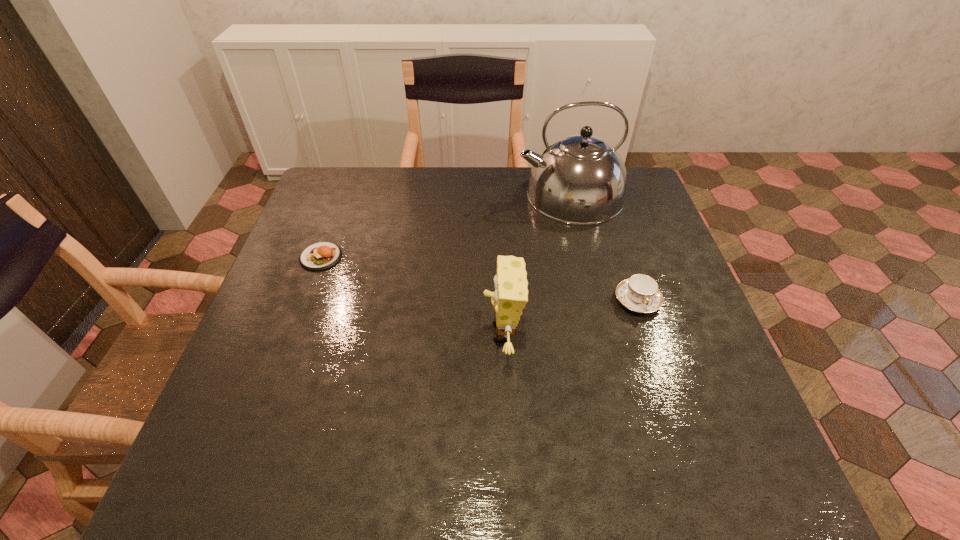
The image size is (960, 540). In the image, there is a desktop. What are the coordinates of `free space at the far edge` in the screenshot? It's located at (475, 198).

In the image, there is a desktop. At what (x,y) coordinates should I click in order to perform the action: click on free space at the left edge. Please return your answer as a coordinate pair (x, y). Looking at the image, I should click on (233, 443).

Image resolution: width=960 pixels, height=540 pixels. Identify the location of free location at the right edge of the desktop. 660,325.

You are a GUI agent. You are given a task and a screenshot of the screen. Output one action in this format:
    pyautogui.click(x=<x>, y=<y>)
    Task: Click on the vacant space at the far left corner
    The width and height of the screenshot is (960, 540).
    Given the screenshot: What is the action you would take?
    pyautogui.click(x=358, y=168)

Locate an element on the screen. The height and width of the screenshot is (540, 960). free location at the far right corner is located at coordinates (635, 211).

In the image, there is a desktop. What are the coordinates of `blank space at the near right corner` in the screenshot? It's located at (679, 446).

Locate an element on the screen. unoccupied position between the kettle and the teacup is located at coordinates (604, 248).

Locate an element on the screen. free space between the third tallest object and the third object from right to left is located at coordinates (570, 316).

Find the location of a particular element. unoccupied position between the second farthest object and the second tallest object is located at coordinates (412, 294).

You are a GUI agent. You are given a task and a screenshot of the screen. Output one action in this format:
    pyautogui.click(x=<x>, y=<y>)
    Task: Click on the free point between the third tallest object and the patty (food)
    
    Given the screenshot: What is the action you would take?
    pyautogui.click(x=479, y=279)